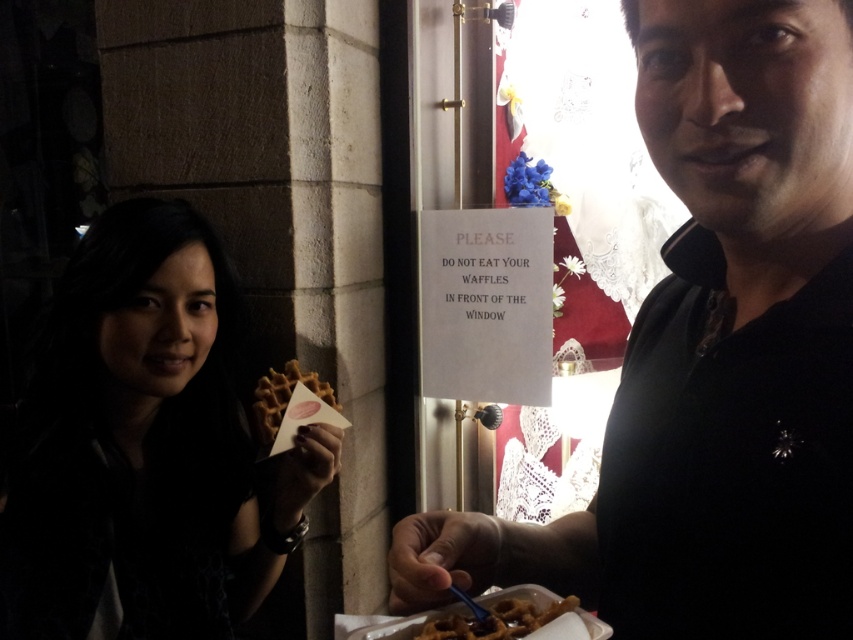
Question: Does black matte shirt at center appear over matte brown waffle at left?

Choices:
 (A) no
 (B) yes

Answer: (B)

Question: Which object is the farthest from the black matte shirt at center?

Choices:
 (A) golden brown crispy waffle at lower center
 (B) golden brown waffle at center
 (C) matte brown waffle at left

Answer: (B)

Question: Can you confirm if black matte shirt at center is positioned to the left of golden brown crispy waffle at lower center?

Choices:
 (A) yes
 (B) no

Answer: (B)

Question: Which point is closer to the camera?

Choices:
 (A) (292, 369)
 (B) (770, 353)

Answer: (B)

Question: Which point is closer to the camera taking this photo?

Choices:
 (A) (4, 595)
 (B) (270, 381)
 (C) (682, 326)

Answer: (C)

Question: Does golden brown crispy waffle at lower center have a greater width compared to golden brown waffle at center?

Choices:
 (A) yes
 (B) no

Answer: (B)